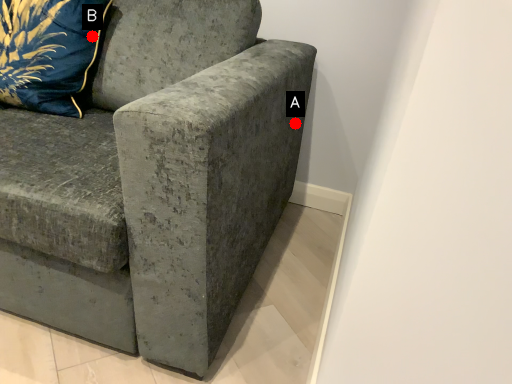
Question: Two points are circled on the image, labeled by A and B beside each circle. Which point is closer to the camera taking this photo?

Choices:
 (A) A is closer
 (B) B is closer

Answer: (B)